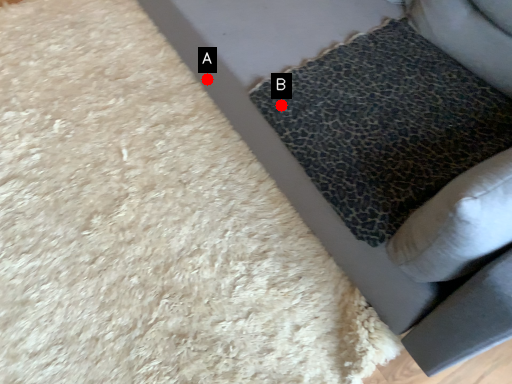
Question: Two points are circled on the image, labeled by A and B beside each circle. Which point is closer to the camera?

Choices:
 (A) A is closer
 (B) B is closer

Answer: (B)